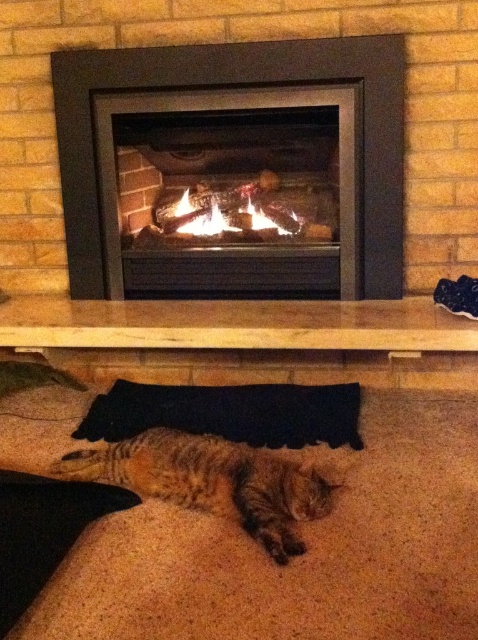
You are standing in the living room and want to place a decorative vase on the mantel shelf in front of the matte black fireplace at center. However, there are already objects on the mantel. Where should you place the vase so it doesn not block the view of the orange flame logs at center?

You should place the vase on the right side of the matte black fireplace at center where the black shoes with white soles are located, as the orange flame logs at center are positioned below it and placing the vase there won not obstruct the view of the flames.